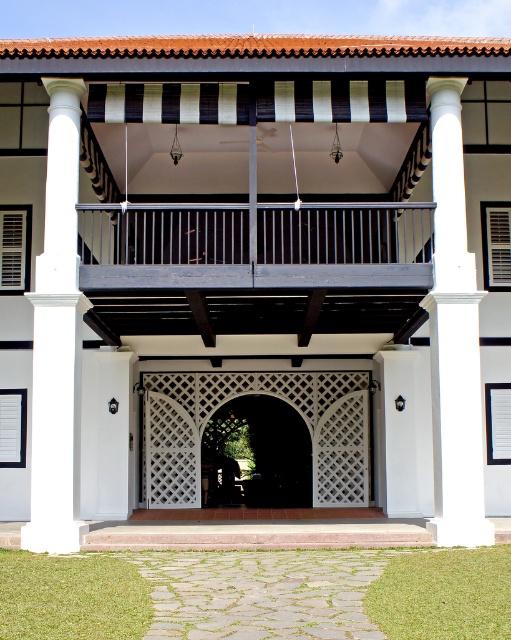
Does white smooth column at left appear over white lattice gate at center?

Yes, white smooth column at left is above white lattice gate at center.

Measure the distance from white smooth column at left to white lattice gate at center.

5.58 meters

Does point (65, 134) come farther from viewer compared to point (198, 385)?

No, it is in front of (198, 385).

The height and width of the screenshot is (640, 511). In order to click on white smooth column at left in this screenshot , I will do `click(58, 339)`.

Is point (275, 216) positioned in front of point (296, 412)?

That is True.

Who is positioned more to the left, dark gray metal railing at upper center or dark wood lattice door at center?

dark wood lattice door at center is more to the left.

Who is more distant from viewer, (x=401, y=227) or (x=237, y=404)?

The point (x=237, y=404) is behind.

You are a GUI agent. You are given a task and a screenshot of the screen. Output one action in this format:
    pyautogui.click(x=<x>, y=<y>)
    Task: Click on the dark gray metal railing at upper center
    This screenshot has width=511, height=640.
    Given the screenshot: What is the action you would take?
    pyautogui.click(x=257, y=244)

Is white smooth column at left thinner than dark wood lattice door at center?

Yes.

The width and height of the screenshot is (511, 640). Describe the element at coordinates (58, 339) in the screenshot. I see `white smooth column at left` at that location.

Find the location of a particular element. white smooth column at left is located at coordinates (58, 339).